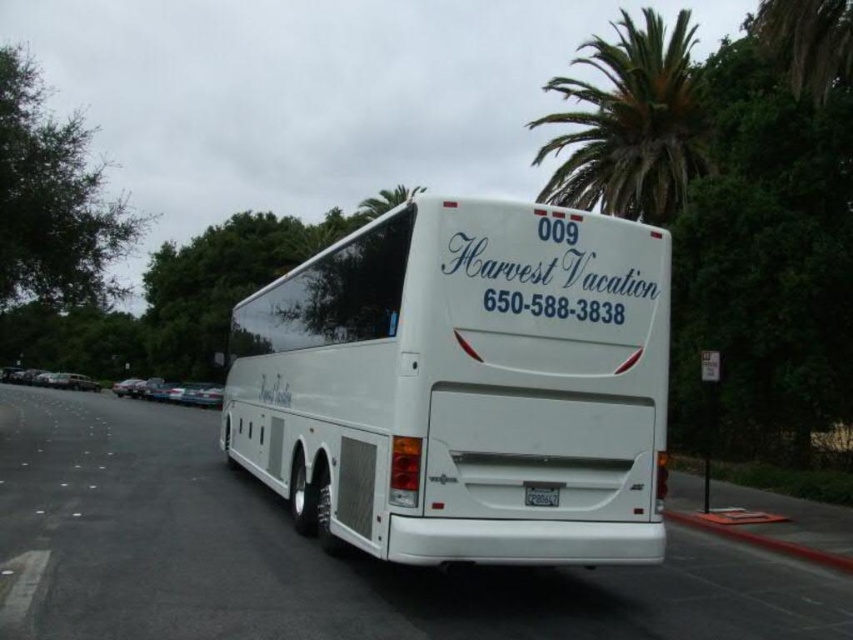
Based on the photo, is green leafy palm tree at upper right taller than green leafy palm tree at upper center?

Correct, green leafy palm tree at upper right is much taller as green leafy palm tree at upper center.

Can you confirm if green leafy palm tree at upper right is thinner than green leafy palm tree at upper center?

No, green leafy palm tree at upper right is not thinner than green leafy palm tree at upper center.

At what (x,y) coordinates should I click in order to perform the action: click on green leafy palm tree at upper right. Please return your answer as a coordinate pair (x, y). This screenshot has height=640, width=853. Looking at the image, I should click on (630, 122).

Who is shorter, red rubber curb at lower right or green leafy palm tree at upper center?

red rubber curb at lower right is shorter.

Which is more to the left, red rubber curb at lower right or green leafy palm tree at upper center?

green leafy palm tree at upper center is more to the left.

Image resolution: width=853 pixels, height=640 pixels. What do you see at coordinates (764, 541) in the screenshot?
I see `red rubber curb at lower right` at bounding box center [764, 541].

Where is `red rubber curb at lower right`? This screenshot has height=640, width=853. red rubber curb at lower right is located at coordinates (764, 541).

Is white glossy bus at center smaller than red rubber curb at lower right?

Actually, white glossy bus at center might be larger than red rubber curb at lower right.

The image size is (853, 640). Describe the element at coordinates (463, 385) in the screenshot. I see `white glossy bus at center` at that location.

In order to click on white glossy bus at center in this screenshot , I will do `click(463, 385)`.